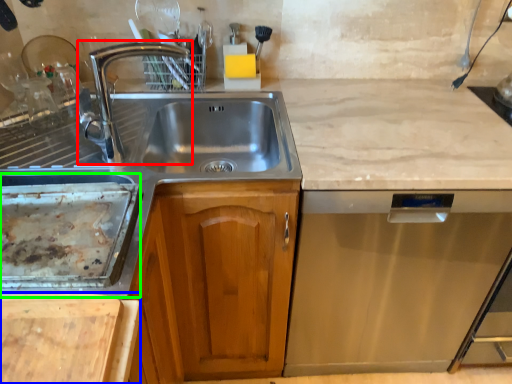
Question: Which object is positioned closest to tap (highlighted by a red box)? Select from cutting board (highlighted by a blue box) and appliance (highlighted by a green box).

Choices:
 (A) cutting board
 (B) appliance

Answer: (B)